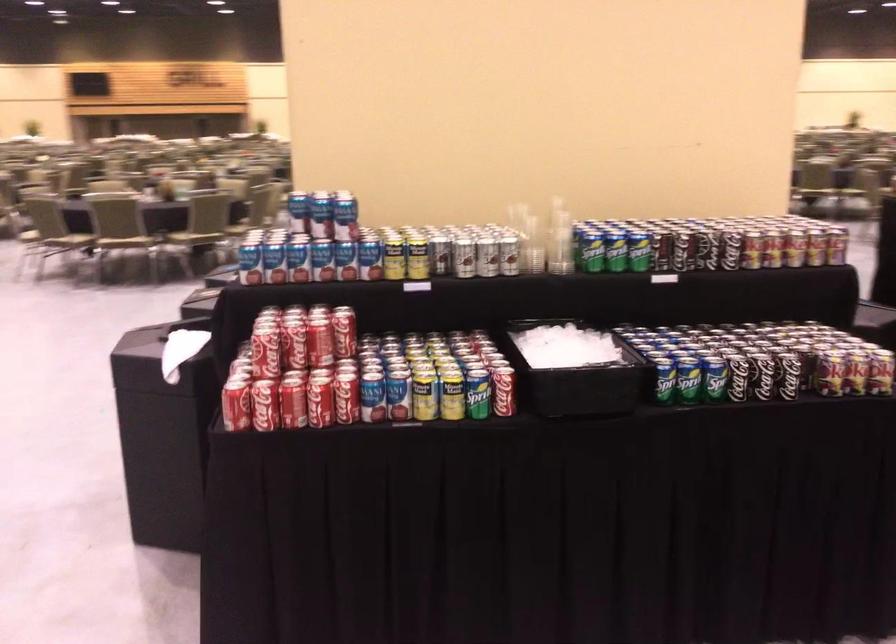
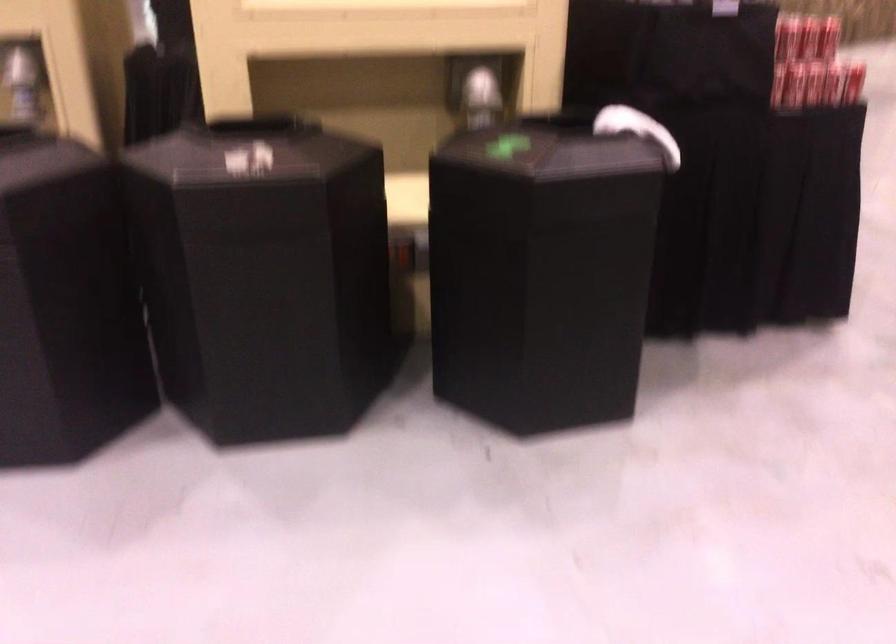
The point at (228, 390) is marked in the first image. Where is the corresponding point in the second image?

(833, 84)